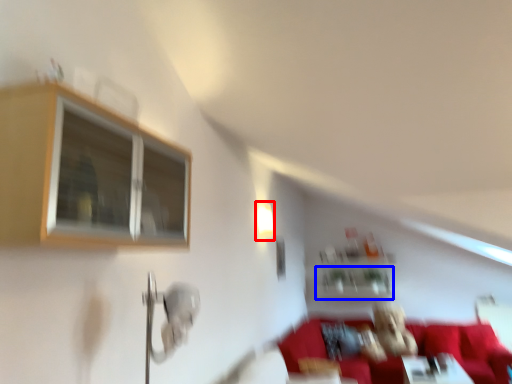
Question: Among these objects, which one is nearest to the camera, light fixture (highlighted by a red box) or shelf (highlighted by a blue box)?

Choices:
 (A) light fixture
 (B) shelf

Answer: (A)